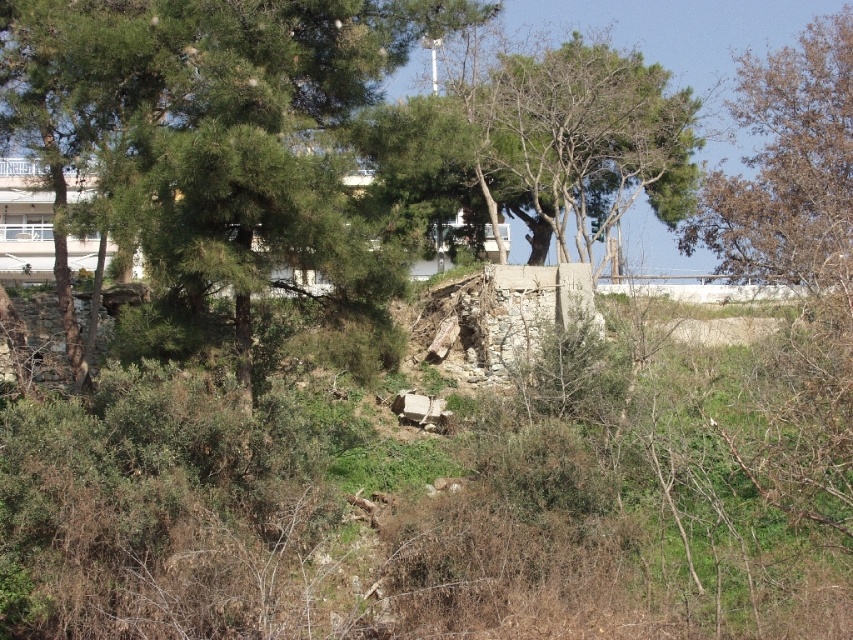
You are standing at the origin point in the image. Which direction should you move to reach the green leafy tree at center?

The green leafy tree at center is located at point 0.198 on the x and 0.251 on the y, so you should move northeast to reach it.

You are standing in the natural scene and want to take a photo of the green leafy tree at center and the brown leafy tree at upper right. Which tree will appear larger in the photo?

The green leafy tree at center will appear larger in the photo because it is closer to you than the brown leafy tree at upper right.